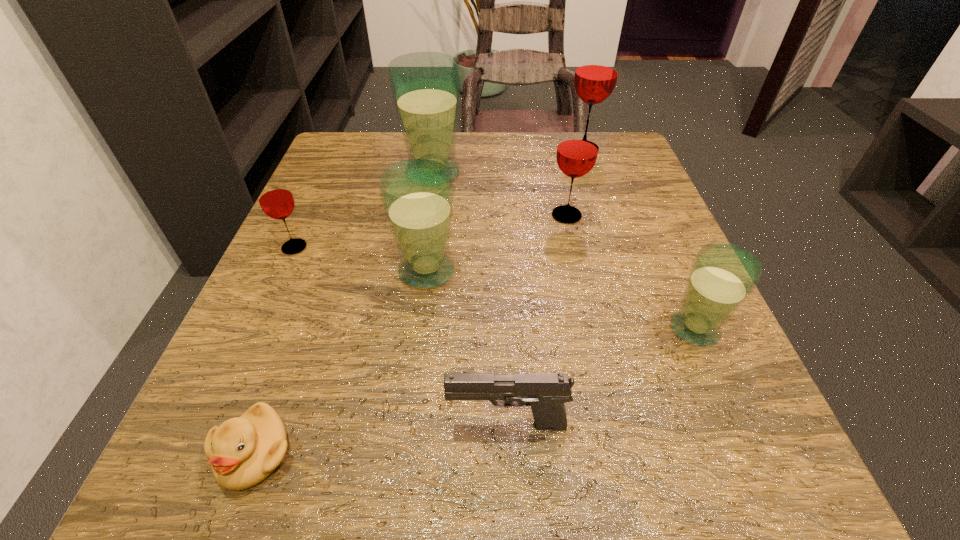
This screenshot has height=540, width=960. Find the location of `the farthest red glass`. the farthest red glass is located at coordinates (596, 73).

Find the location of a particular element. This screenshot has height=540, width=960. the biggest blue glass is located at coordinates pos(425,86).

Locate an element on the screen. the second farthest red glass is located at coordinates (577, 151).

Locate an element on the screen. The height and width of the screenshot is (540, 960). the second smallest red glass is located at coordinates click(x=577, y=151).

Find the location of a particular element. the second biggest blue glass is located at coordinates (417, 195).

Where is `the nearest red glass`? the nearest red glass is located at coordinates (275, 198).

At what (x,y) coordinates should I click in order to perform the action: click on the leftmost glass. Please return your answer as a coordinate pair (x, y). Looking at the image, I should click on [275, 198].

Find the location of `the sixth farthest object`. the sixth farthest object is located at coordinates (722, 276).

You are a GUI agent. You are given a task and a screenshot of the screen. Output one action in this format:
    pyautogui.click(x=<x>, y=<y>)
    Task: Click on the nearest blue glass
    
    Given the screenshot: What is the action you would take?
    pyautogui.click(x=722, y=276)

You are a GUI agent. You are given a task and a screenshot of the screen. Output one action in this format:
    pyautogui.click(x=<x>, y=<y>)
    Task: Click on the pistol
    
    Given the screenshot: What is the action you would take?
    pyautogui.click(x=546, y=393)